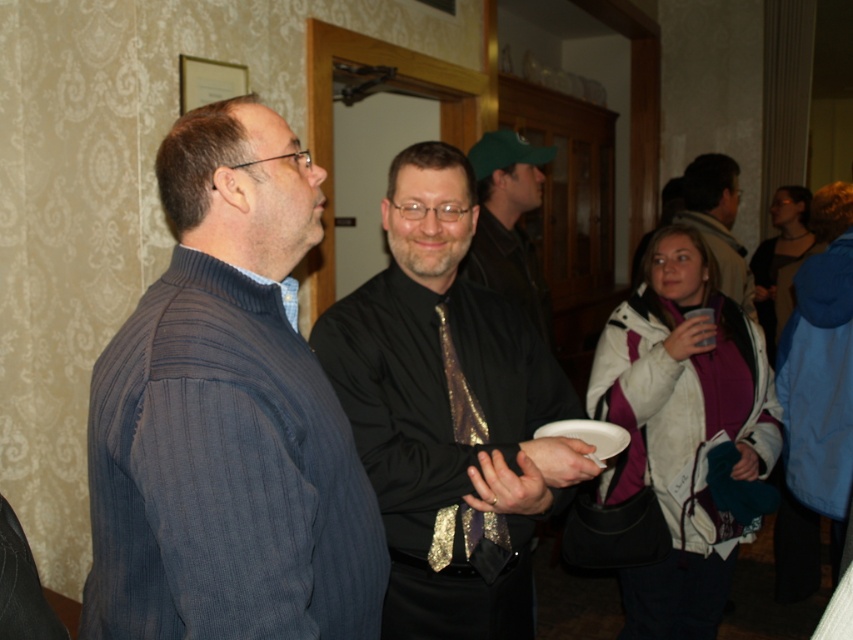
Question: Observing the image, what is the correct spatial positioning of shiny gold tie at center in reference to matte black shirt at center?

Choices:
 (A) right
 (B) left

Answer: (B)

Question: Does shiny gold tie at center have a larger size compared to white paper plate at center?

Choices:
 (A) yes
 (B) no

Answer: (A)

Question: Is matte black shirt at center above white paper plate at center?

Choices:
 (A) no
 (B) yes

Answer: (B)

Question: Which object is positioned closest to the matte black shirt at center?

Choices:
 (A) white paper plate at center
 (B) ribbed sweater at left
 (C) shiny black tie at center

Answer: (C)

Question: Considering the real-world distances, which object is closest to the ribbed sweater at left?

Choices:
 (A) shiny black tie at center
 (B) white paper plate at center
 (C) matte black shirt at center
 (D) shiny gold tie at center

Answer: (D)

Question: Which object appears closest to the camera in this image?

Choices:
 (A) matte black shirt at center
 (B) white paper plate at center

Answer: (B)